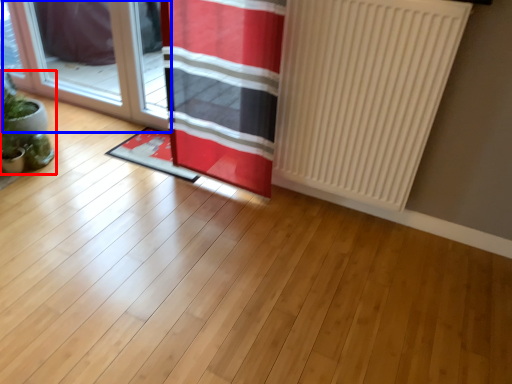
Question: Which of the following is the closest to the observer, houseplant (highlighted by a red box) or door (highlighted by a blue box)?

Choices:
 (A) houseplant
 (B) door

Answer: (A)